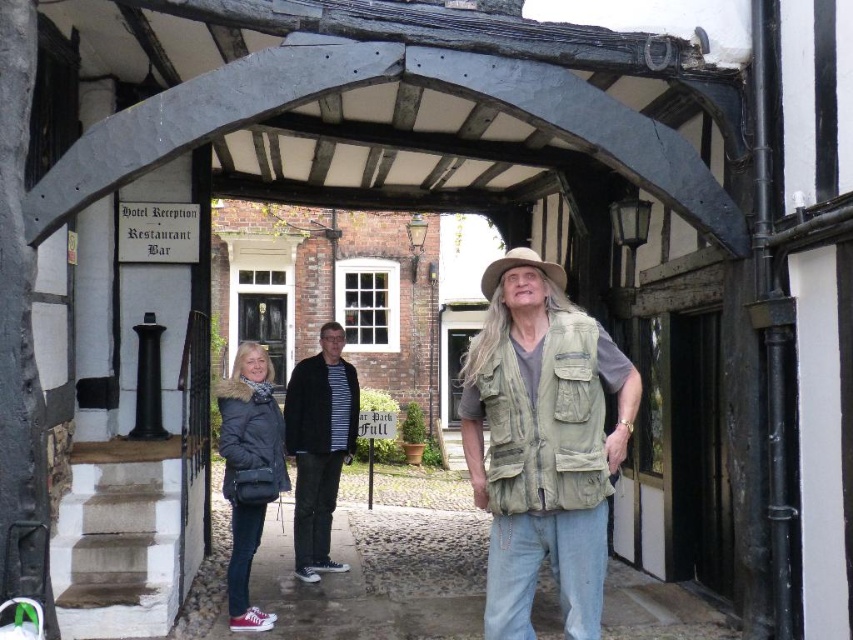
You are a photographer trying to capture a photo of the khaki fabric vest at center and the beige fabric cowboy hat at center. Which object should you focus on first if you want to include both in your frame without moving the camera?

The khaki fabric vest at center should be focused on first since it is positioned on the left side of the beige fabric cowboy hat at center, so adjusting focus to the left will ensure both are in frame.

You are a delivery person standing at point (248, 472). You need to deliver a package to the Hotel Reception Restaurant Bar sign on the left side of the archway. Is the matte black jacket at lower left blocking your path to the sign?

The matte black jacket at lower left is located at point (248, 472), which is your current position. Since you are already at that point, the matte black jacket at lower left is not blocking your path to the Hotel Reception Restaurant Bar sign on the left side of the archway.